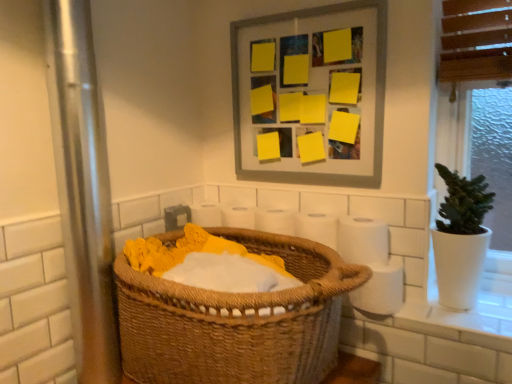
In order to face white paper at center, which appears as the 1th toilet paper when viewed from the top, should I rotate leftwards or rightwards?

It's best to rotate right around 8.527 degrees.

Identify the location of white paper at center, which appears as the 1th toilet paper when viewed from the top. This screenshot has width=512, height=384. (317, 228).

Is white matte toilet paper at right, the 2th toilet paper positioned from the bottom, at the back of matte gray picture frame at upper center?

No, matte gray picture frame at upper center's orientation is not away from white matte toilet paper at right, the 2th toilet paper positioned from the bottom.

From the matte gray picture frame at upper center, count 2nd toilet paper to the right and point to it. Please provide its 2D coordinates.

[(362, 240)]

Which object is wider, matte gray picture frame at upper center or white matte toilet paper at right, which is counted as the 2th toilet paper, starting from the top?

white matte toilet paper at right, which is counted as the 2th toilet paper, starting from the top.

Can you confirm if white matte toilet paper at right, the 2th toilet paper positioned from the bottom, is positioned to the right of white matte toilet paper at right, the 3th toilet paper in the top-to-bottom sequence?

In fact, white matte toilet paper at right, the 2th toilet paper positioned from the bottom, is to the left of white matte toilet paper at right, the 3th toilet paper in the top-to-bottom sequence.

Would you consider white matte toilet paper at right, which is counted as the 2th toilet paper, starting from the top, to be distant from white matte toilet paper at right, the 3th toilet paper in the top-to-bottom sequence?

white matte toilet paper at right, which is counted as the 2th toilet paper, starting from the top, is near white matte toilet paper at right, the 3th toilet paper in the top-to-bottom sequence, not far away.

Find the location of `toilet paper that appears below the white matte toilet paper at right, the 2th toilet paper positioned from the bottom (from the image's perspective)`. toilet paper that appears below the white matte toilet paper at right, the 2th toilet paper positioned from the bottom (from the image's perspective) is located at coordinates (381, 289).

Does white matte toilet paper at right, which appears as the first toilet paper when ordered from the bottom, have a greater width compared to woven brown basket at center?

In fact, white matte toilet paper at right, which appears as the first toilet paper when ordered from the bottom, might be narrower than woven brown basket at center.

How many degrees apart are the facing directions of white matte toilet paper at right, which appears as the first toilet paper when ordered from the bottom, and woven brown basket at center?

white matte toilet paper at right, which appears as the first toilet paper when ordered from the bottom, and woven brown basket at center are facing 0.00337 degrees away from each other.

From a real-world perspective, is white matte toilet paper at right, which appears as the first toilet paper when ordered from the bottom, on woven brown basket at center?

No, from a real-world perspective, white matte toilet paper at right, which appears as the first toilet paper when ordered from the bottom, is not on top of woven brown basket at center.

Can you confirm if white matte toilet paper at right, which appears as the first toilet paper when ordered from the bottom, is bigger than woven brown basket at center?

No, white matte toilet paper at right, which appears as the first toilet paper when ordered from the bottom, is not bigger than woven brown basket at center.

Is woven brown basket at center looking in the opposite direction of matte gray picture frame at upper center?

No, woven brown basket at center is not facing the opposite direction of matte gray picture frame at upper center.

Considering the sizes of objects woven brown basket at center and matte gray picture frame at upper center in the image provided, who is bigger, woven brown basket at center or matte gray picture frame at upper center?

woven brown basket at center is bigger.

From a real-world perspective, which object rests below the other?

woven brown basket at center is physically lower.

In order to click on basket on the left of matte gray picture frame at upper center in this screenshot , I will do `click(237, 320)`.

Considering the sizes of white matte toilet paper at right, the 3th toilet paper in the top-to-bottom sequence, and white paper at center, the 3th toilet paper positioned from the bottom, in the image, is white matte toilet paper at right, the 3th toilet paper in the top-to-bottom sequence, wider or thinner than white paper at center, the 3th toilet paper positioned from the bottom,?

white matte toilet paper at right, the 3th toilet paper in the top-to-bottom sequence, is wider than white paper at center, the 3th toilet paper positioned from the bottom.

Is white matte toilet paper at right, the 3th toilet paper in the top-to-bottom sequence, further to the viewer compared to white paper at center, which appears as the 1th toilet paper when viewed from the top?

No, it is in front of white paper at center, which appears as the 1th toilet paper when viewed from the top.

From a real-world perspective, between white matte toilet paper at right, the 3th toilet paper in the top-to-bottom sequence, and white paper at center, the 3th toilet paper positioned from the bottom, who is vertically higher?

white paper at center, the 3th toilet paper positioned from the bottom, from a real-world perspective.

Is white matte toilet paper at right, the 3th toilet paper in the top-to-bottom sequence, far from white paper at center, which appears as the 1th toilet paper when viewed from the top?

white matte toilet paper at right, the 3th toilet paper in the top-to-bottom sequence, is near white paper at center, which appears as the 1th toilet paper when viewed from the top, not far away.

Image resolution: width=512 pixels, height=384 pixels. Identify the location of the 2nd toilet paper counting from the right of the matte gray picture frame at upper center. (362, 240).

Can you confirm if white matte toilet paper at right, the 2th toilet paper positioned from the bottom, is wider than matte gray picture frame at upper center?

Correct, the width of white matte toilet paper at right, the 2th toilet paper positioned from the bottom, exceeds that of matte gray picture frame at upper center.

Which point is more forward, (360, 259) or (296, 103)?

The point (360, 259) is closer.

Based on the photo, does white matte toilet paper at right, the 2th toilet paper positioned from the bottom, come behind matte gray picture frame at upper center?

No.

Is matte gray picture frame at upper center aimed at white paper at center, the 3th toilet paper positioned from the bottom?

No.

Considering the positions of objects matte gray picture frame at upper center and white paper at center, which appears as the 1th toilet paper when viewed from the top, in the image provided, who is more to the right, matte gray picture frame at upper center or white paper at center, which appears as the 1th toilet paper when viewed from the top,?

Positioned to the right is white paper at center, which appears as the 1th toilet paper when viewed from the top.

Which is behind, point (364, 79) or point (318, 230)?

The point (318, 230) is more distant.

This screenshot has height=384, width=512. There is a matte gray picture frame at upper center. Identify the location of the 1st toilet paper below it (from a real-world perspective). (362, 240).

I want to click on the 2nd toilet paper positioned above the white matte toilet paper at right, which appears as the first toilet paper when ordered from the bottom (from a real-world perspective), so click(x=362, y=240).

In the scene shown: Looking at the image, which one is located further to white matte toilet paper at right, the 2th toilet paper positioned from the bottom, white paper at center, which appears as the 1th toilet paper when viewed from the top, or woven brown basket at center?

woven brown basket at center lies further to white matte toilet paper at right, the 2th toilet paper positioned from the bottom, than the other object.

Which object lies nearer to the anchor point matte gray picture frame at upper center, woven brown basket at center or white matte toilet paper at right, which appears as the first toilet paper when ordered from the bottom?

Based on the image, woven brown basket at center appears to be nearer to matte gray picture frame at upper center.

When comparing their distances from white matte toilet paper at right, which appears as the first toilet paper when ordered from the bottom, does woven brown basket at center or white matte toilet paper at right, which is counted as the 2th toilet paper, starting from the top, seem further?

Among the two, woven brown basket at center is located further to white matte toilet paper at right, which appears as the first toilet paper when ordered from the bottom.

Looking at the image, which one is located closer to white paper at center, which appears as the 1th toilet paper when viewed from the top, matte gray picture frame at upper center or white matte toilet paper at right, which appears as the first toilet paper when ordered from the bottom?

white matte toilet paper at right, which appears as the first toilet paper when ordered from the bottom, is closer to white paper at center, which appears as the 1th toilet paper when viewed from the top.

When comparing their distances from white paper at center, the 3th toilet paper positioned from the bottom, does woven brown basket at center or white matte toilet paper at right, which is counted as the 2th toilet paper, starting from the top, seem further?

woven brown basket at center is further to white paper at center, the 3th toilet paper positioned from the bottom.

Estimate the real-world distances between objects in this image. Which object is closer to matte gray picture frame at upper center, white matte toilet paper at right, the 3th toilet paper in the top-to-bottom sequence, or white paper at center, which appears as the 1th toilet paper when viewed from the top?

white paper at center, which appears as the 1th toilet paper when viewed from the top, lies closer to matte gray picture frame at upper center than the other object.

Estimate the real-world distances between objects in this image. Which object is closer to white matte toilet paper at right, the 3th toilet paper in the top-to-bottom sequence, white paper at center, which appears as the 1th toilet paper when viewed from the top, or white matte toilet paper at right, which is counted as the 2th toilet paper, starting from the top?

white matte toilet paper at right, which is counted as the 2th toilet paper, starting from the top, is closer to white matte toilet paper at right, the 3th toilet paper in the top-to-bottom sequence.

From the image, which object appears to be nearer to matte gray picture frame at upper center, white matte toilet paper at right, which appears as the first toilet paper when ordered from the bottom, or white matte toilet paper at right, which is counted as the 2th toilet paper, starting from the top?

white matte toilet paper at right, which is counted as the 2th toilet paper, starting from the top, is positioned closer to the anchor matte gray picture frame at upper center.

Where is `toilet paper between matte gray picture frame at upper center and white matte toilet paper at right, which is counted as the 2th toilet paper, starting from the top, in the vertical direction`? The height and width of the screenshot is (384, 512). toilet paper between matte gray picture frame at upper center and white matte toilet paper at right, which is counted as the 2th toilet paper, starting from the top, in the vertical direction is located at coordinates (317, 228).

What are the coordinates of `toilet paper situated between white paper at center, which appears as the 1th toilet paper when viewed from the top, and white matte toilet paper at right, the 3th toilet paper in the top-to-bottom sequence, from left to right` in the screenshot? It's located at (362, 240).

What are the coordinates of `toilet paper between woven brown basket at center and white matte toilet paper at right, the 2th toilet paper positioned from the bottom, along the z-axis` in the screenshot? It's located at tap(381, 289).